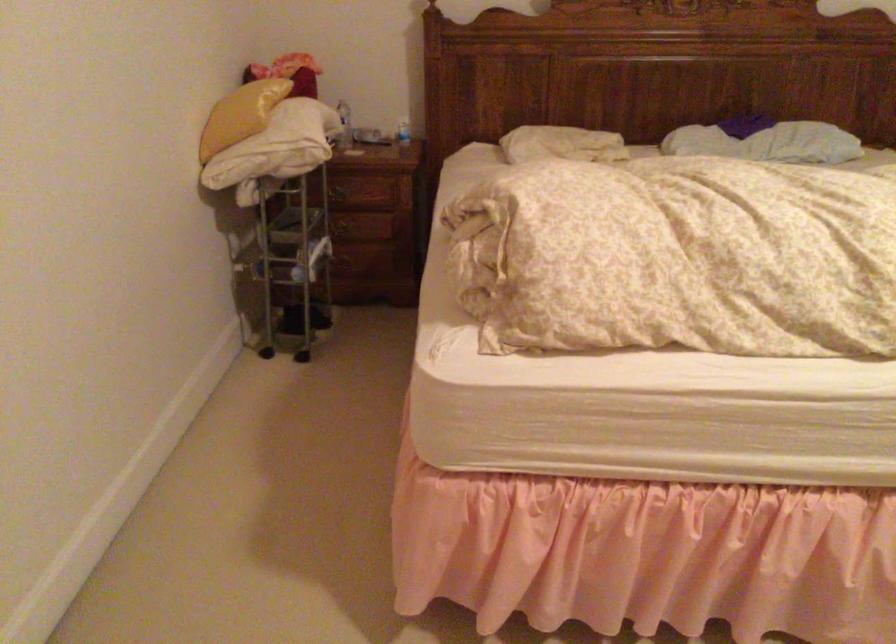
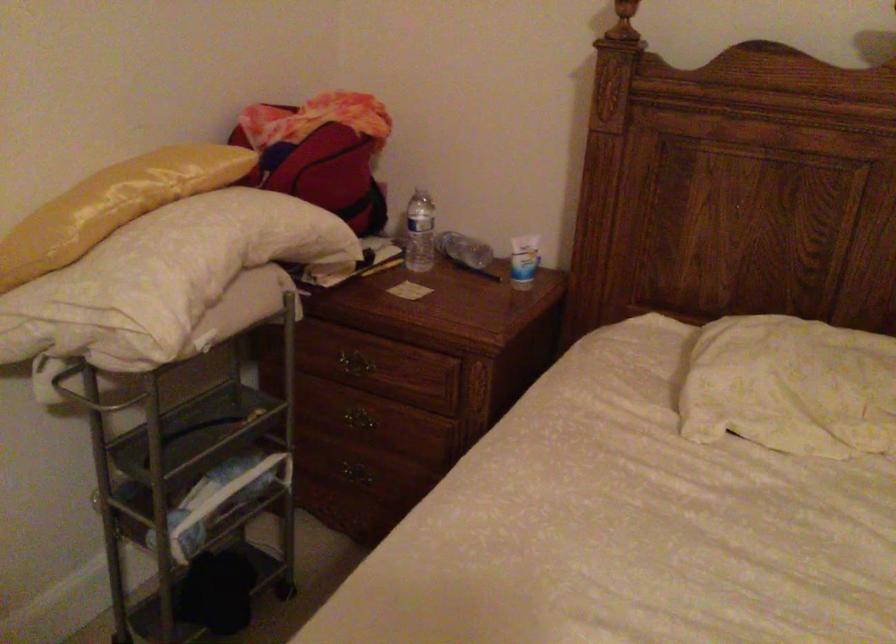
In the second image, find the point that corresponds to point 269,104 in the first image.

(113, 205)